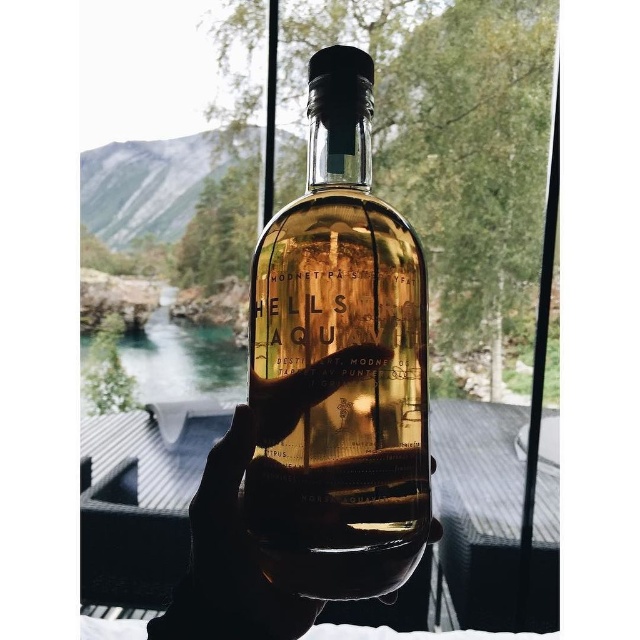
You are a photographer trying to capture the translucent amber glass bottle at center in focus. If your camera has a depth of field that can sharply focus objects within 6 inches from its current position, will the bottle be in focus?

The translucent amber glass bottle at center is 6.72 inches away from camera, which is slightly beyond the 6 inches depth of field range. Therefore, the bottle will not be in focus.

You are designing a display case for the translucent amber glass bottle at center and the translucent glass bottle at center. Which bottle should be placed at the back to ensure both are fully visible?

The translucent amber glass bottle at center is much taller than the translucent glass bottle at center, so it should be placed at the back to ensure both are fully visible.

You are a bartender preparing a cocktail and need to choose between the translucent amber glass bottle at center and the translucent glass bottle at center. Which bottle should you pick if you need a larger container for mixing ingredients?

The translucent amber glass bottle at center is larger than the translucent glass bottle at center, so you should choose the translucent amber glass bottle at center for a larger container.